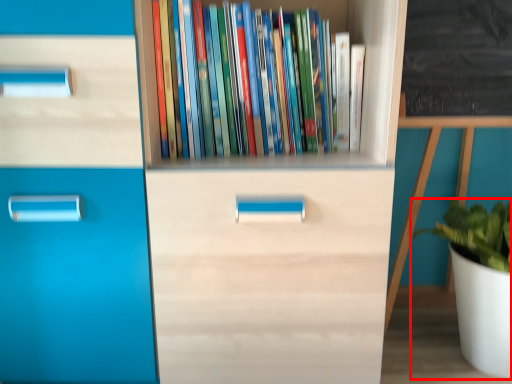
Question: In this image, where is houseplant (annotated by the red box) located relative to book?

Choices:
 (A) left
 (B) right

Answer: (B)